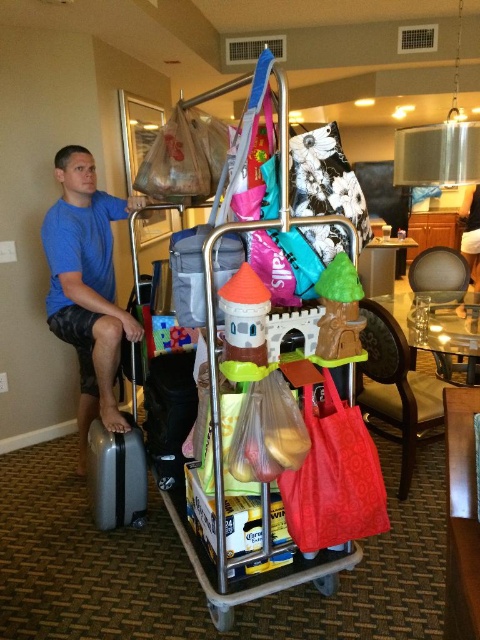
Who is taller, black fabric suitcase at lower left or silver metallic suitcase at lower left?

black fabric suitcase at lower left

Is point (186, 369) in front of point (134, 445)?

Yes, point (186, 369) is in front of point (134, 445).

Is point (151, 451) closer to viewer compared to point (123, 522)?

No.

Locate an element on the screen. The image size is (480, 640). black fabric suitcase at lower left is located at coordinates (168, 413).

Does blue cotton shirt at left appear on the right side of matte plastic suitcase at center?

In fact, blue cotton shirt at left is to the left of matte plastic suitcase at center.

Describe the element at coordinates (86, 285) in the screenshot. The width and height of the screenshot is (480, 640). I see `blue cotton shirt at left` at that location.

This screenshot has height=640, width=480. Identify the location of blue cotton shirt at left. (86, 285).

You are a GUI agent. You are given a task and a screenshot of the screen. Output one action in this format:
    pyautogui.click(x=<x>, y=<y>)
    Task: Click on the blue cotton shirt at left
    
    Given the screenshot: What is the action you would take?
    pyautogui.click(x=86, y=285)

Between point (59, 291) and point (211, 573), which one is positioned in front?

Point (211, 573)

Between blue cotton shirt at left and plastic shopping cart at center, which one is positioned higher?

blue cotton shirt at left

Who is more distant from viewer, (84, 436) or (256, 550)?

The point (84, 436) is more distant.

The height and width of the screenshot is (640, 480). What are the coordinates of `blue cotton shirt at left` in the screenshot? It's located at (86, 285).